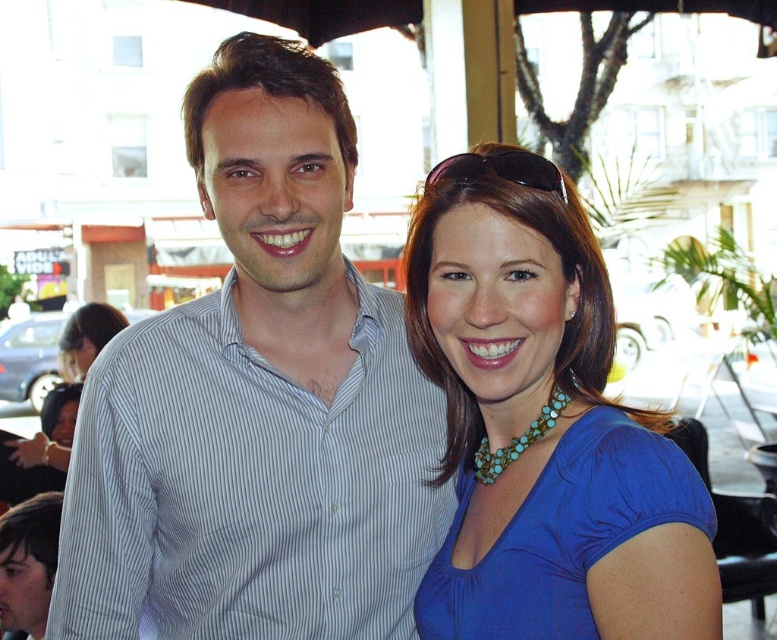
You are a photographer trying to capture a photo of both the light blue striped shirt at center and the blue fabric dress at center. Since you want both subjects to be in focus, which one should you adjust your camera focus on first?

You should focus on the light blue striped shirt at center first because it is closer to the viewer than the blue fabric dress at center, ensuring both will be in focus when using depth of field properly.

You are a photographer trying to capture a closeup of both the light blue striped shirt at center and the turquoise beaded necklace at center. Given that the camera can only focus on one object at a time, which object should you focus on first to ensure it appears larger in the photo?

The light blue striped shirt at center is larger than the turquoise beaded necklace at center, so you should focus on the light blue striped shirt at center first to ensure it appears larger in the photo.